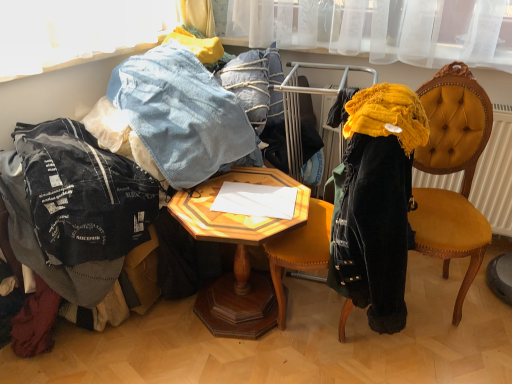
Question: Is denim at left taller than ripped denim jacket at lower left?

Choices:
 (A) yes
 (B) no

Answer: (B)

Question: Does denim at left have a greater width compared to ripped denim jacket at lower left?

Choices:
 (A) yes
 (B) no

Answer: (B)

Question: Does denim at left have a lesser width compared to ripped denim jacket at lower left?

Choices:
 (A) yes
 (B) no

Answer: (A)

Question: Are denim at left and ripped denim jacket at lower left far apart?

Choices:
 (A) yes
 (B) no

Answer: (B)

Question: Considering the relative sizes of denim at left and ripped denim jacket at lower left in the image provided, is denim at left bigger than ripped denim jacket at lower left?

Choices:
 (A) yes
 (B) no

Answer: (A)

Question: Is denim at left positioned with its back to ripped denim jacket at lower left?

Choices:
 (A) yes
 (B) no

Answer: (B)

Question: Is ripped denim jacket at lower left facing away from velvet yellow chair at right?

Choices:
 (A) no
 (B) yes

Answer: (A)

Question: Is ripped denim jacket at lower left at the left side of velvet yellow chair at right?

Choices:
 (A) yes
 (B) no

Answer: (A)

Question: From a real-world perspective, is ripped denim jacket at lower left positioned over velvet yellow chair at right based on gravity?

Choices:
 (A) yes
 (B) no

Answer: (B)

Question: Are ripped denim jacket at lower left and velvet yellow chair at right beside each other?

Choices:
 (A) yes
 (B) no

Answer: (B)

Question: Could velvet yellow chair at right be considered to be inside ripped denim jacket at lower left?

Choices:
 (A) no
 (B) yes

Answer: (A)

Question: Is ripped denim jacket at lower left thinner than velvet yellow chair at right?

Choices:
 (A) no
 (B) yes

Answer: (A)

Question: Is ripped denim jacket at lower left facing away from denim at left?

Choices:
 (A) no
 (B) yes

Answer: (A)